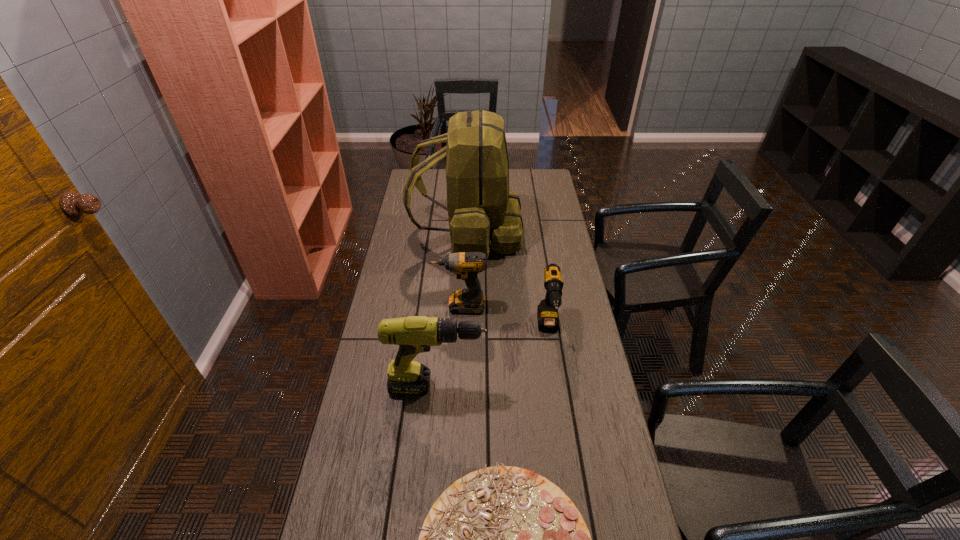
Locate an element on the screen. This screenshot has width=960, height=540. backpack is located at coordinates (480, 206).

The image size is (960, 540). Identify the location of the tallest object. (480, 206).

This screenshot has height=540, width=960. I want to click on the second nearest object, so click(x=414, y=334).

At what (x,y) coordinates should I click in order to perform the action: click on the nearest drill. Please return your answer as a coordinate pair (x, y). This screenshot has width=960, height=540. Looking at the image, I should click on (414, 334).

Where is `the rightmost drill`? Image resolution: width=960 pixels, height=540 pixels. the rightmost drill is located at coordinates (547, 312).

Where is `blank area located on the front-facing side of the farthest object`? Image resolution: width=960 pixels, height=540 pixels. blank area located on the front-facing side of the farthest object is located at coordinates (533, 234).

The width and height of the screenshot is (960, 540). Find the location of `vacant space situated on the handle side of the fourth farthest object`. vacant space situated on the handle side of the fourth farthest object is located at coordinates (505, 386).

Where is `vacant space located at the tip of the rightmost drill`? The height and width of the screenshot is (540, 960). vacant space located at the tip of the rightmost drill is located at coordinates (558, 393).

Identify the location of backpack present at the left edge. This screenshot has width=960, height=540. [480, 206].

Where is `drill at the left edge`? The image size is (960, 540). drill at the left edge is located at coordinates (414, 334).